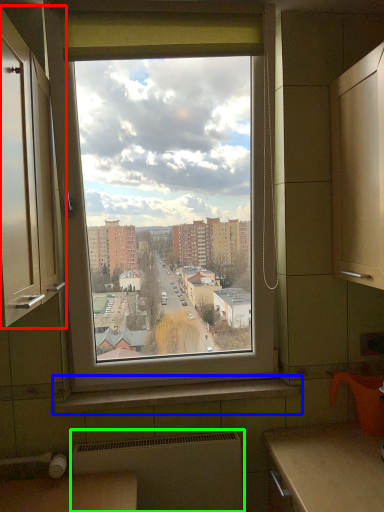
Question: Which object is the farthest from cabinetry (highlighted by a red box)? Choose among these: window sill (highlighted by a blue box) or radiator (highlighted by a green box).

Choices:
 (A) window sill
 (B) radiator

Answer: (B)